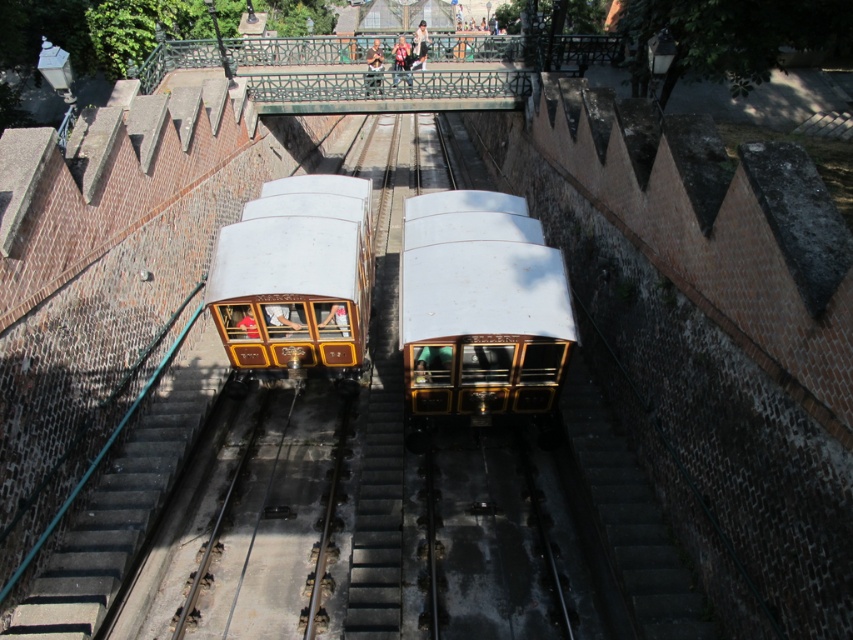
Is white polished wood train at center below gold polished wood train at center?

Indeed, white polished wood train at center is positioned under gold polished wood train at center.

Is white polished wood train at center closer to the viewer compared to gold polished wood train at center?

Yes, white polished wood train at center is closer to the viewer.

Locate an element on the screen. white polished wood train at center is located at coordinates (480, 307).